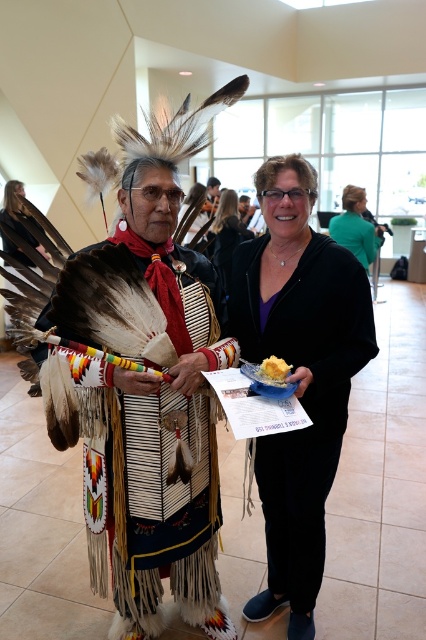
You are a delivery person who needs to place both the matte black jacket at center and the yellow fluffy bread at center on a shelf that can only hold items up to 1 meter in height. Which item should you place first to ensure both fit?

The matte black jacket at center is much taller than the yellow fluffy bread at center. Since the shelf has a height limit of 1 meter, you should place the taller item, the matte black jacket at center, first to ensure it fits before placing the yellow fluffy bread at center.

You are a server in a restaurant and you see a matte black plate at center and a matte black jacket at center. Which object is located lower in the scene?

The matte black plate at center is located below the matte black jacket at center, so the matte black plate at center is lower in the scene.